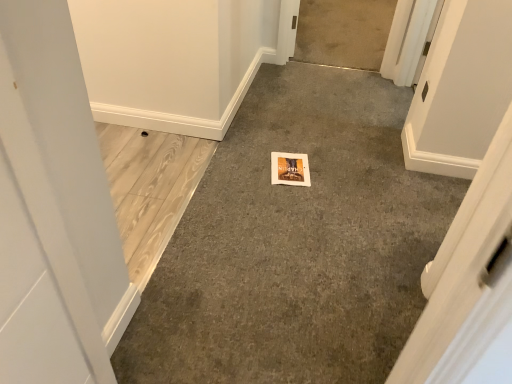
Question: Which direction should I rotate to face gray carpet at center, which is counted as the third concrete, starting from the back, — up or down?

Choices:
 (A) up
 (B) down

Answer: (A)

Question: From a real-world perspective, is gray carpet at center, which is counted as the 1th concrete, starting from the back, positioned over light brown wood flooring at left, which is the 2th concrete in back-to-front order, based on gravity?

Choices:
 (A) no
 (B) yes

Answer: (A)

Question: Can you confirm if gray carpet at center, which is counted as the 1th concrete, starting from the back, is taller than light brown wood flooring at left, which is the 2th concrete in back-to-front order?

Choices:
 (A) no
 (B) yes

Answer: (B)

Question: Is gray carpet at center, the third concrete positioned from the front, at the left side of light brown wood flooring at left, the 2th concrete viewed from the front?

Choices:
 (A) no
 (B) yes

Answer: (A)

Question: Is gray carpet at center, the third concrete positioned from the front, smaller than light brown wood flooring at left, the 2th concrete viewed from the front?

Choices:
 (A) no
 (B) yes

Answer: (A)

Question: From the image's perspective, is gray carpet at center, which is counted as the 1th concrete, starting from the back, beneath light brown wood flooring at left, the 2th concrete viewed from the front?

Choices:
 (A) yes
 (B) no

Answer: (B)

Question: Is gray carpet at center, which is counted as the 1th concrete, starting from the back, aimed at light brown wood flooring at left, which is the 2th concrete in back-to-front order?

Choices:
 (A) yes
 (B) no

Answer: (A)

Question: Does light brown wood flooring at left, the 2th concrete viewed from the front, come behind gray carpet at center, the third concrete positioned from the front?

Choices:
 (A) yes
 (B) no

Answer: (B)

Question: Are light brown wood flooring at left, which is the 2th concrete in back-to-front order, and gray carpet at center, the third concrete positioned from the front, making contact?

Choices:
 (A) no
 (B) yes

Answer: (A)

Question: Is light brown wood flooring at left, which is the 2th concrete in back-to-front order, positioned with its back to gray carpet at center, which is counted as the 1th concrete, starting from the back?

Choices:
 (A) yes
 (B) no

Answer: (B)

Question: From a real-world perspective, is light brown wood flooring at left, which is the 2th concrete in back-to-front order, over gray carpet at center, the third concrete positioned from the front?

Choices:
 (A) no
 (B) yes

Answer: (B)

Question: Is light brown wood flooring at left, which is the 2th concrete in back-to-front order, far from gray carpet at center, the third concrete positioned from the front?

Choices:
 (A) no
 (B) yes

Answer: (B)

Question: Can you confirm if light brown wood flooring at left, the 2th concrete viewed from the front, is shorter than gray carpet at center, which is counted as the 1th concrete, starting from the back?

Choices:
 (A) no
 (B) yes

Answer: (B)

Question: Is gray carpet at center, which is counted as the third concrete, starting from the back, surrounding gray carpet at center, the third concrete positioned from the front?

Choices:
 (A) yes
 (B) no

Answer: (B)